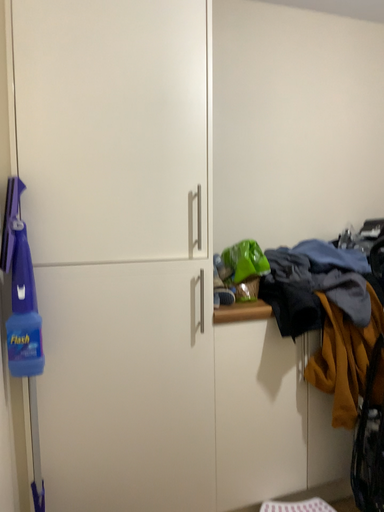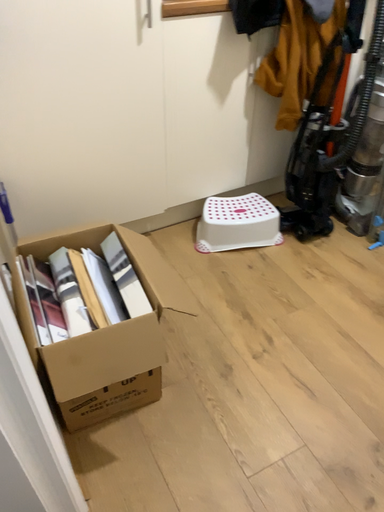
Question: How did the camera likely rotate when shooting the video?

Choices:
 (A) rotated right
 (B) rotated left

Answer: (A)